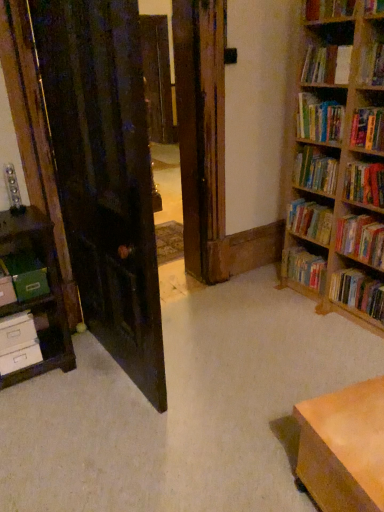
Identify the location of empty space that is ontop of wooden table at lower right (from a real-world perspective). The width and height of the screenshot is (384, 512). (357, 426).